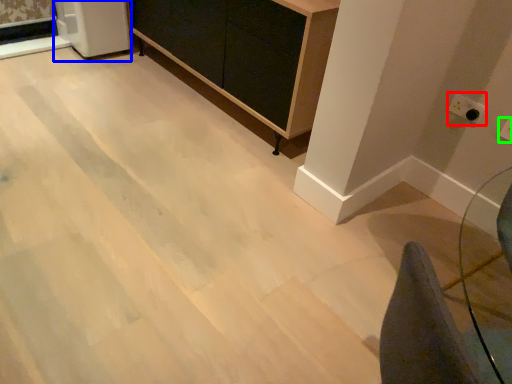
Question: Based on their relative distances, which object is farther from electric outlet (highlighted by a red box)? Choose from appliance (highlighted by a blue box) and electric outlet (highlighted by a green box).

Choices:
 (A) appliance
 (B) electric outlet

Answer: (A)